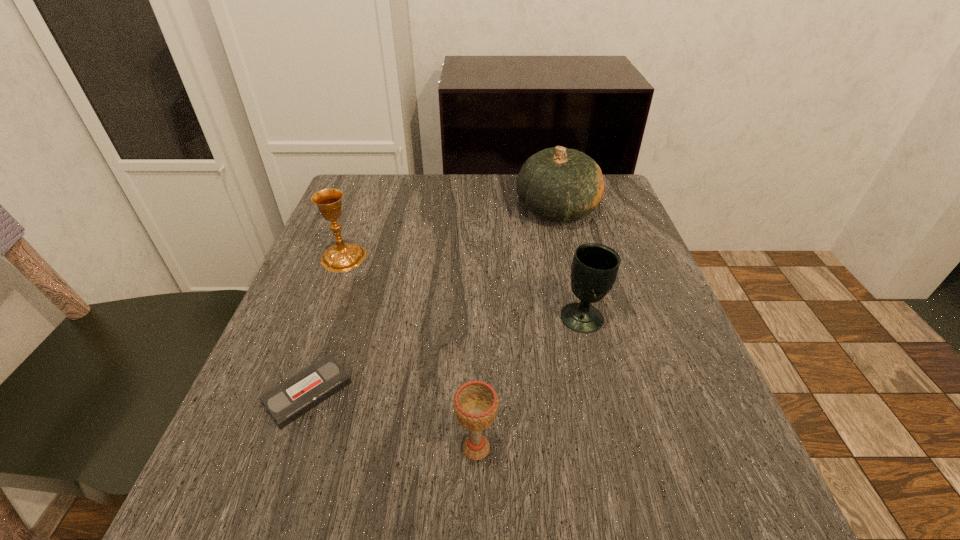
Locate an element on the screen. The width and height of the screenshot is (960, 540). gourd is located at coordinates (559, 184).

The height and width of the screenshot is (540, 960). Find the location of `the leftmost chalice`. the leftmost chalice is located at coordinates (342, 257).

Identify the location of the second farthest object. Image resolution: width=960 pixels, height=540 pixels. (342, 257).

In order to click on the rightmost chalice in this screenshot , I will do pyautogui.click(x=594, y=268).

Locate an element on the screen. The image size is (960, 540). the third farthest object is located at coordinates (594, 268).

Identify the location of the second shortest object. This screenshot has width=960, height=540. (475, 403).

You are a GUI agent. You are given a task and a screenshot of the screen. Output one action in this format:
    pyautogui.click(x=<x>, y=<y>)
    Task: Click on the second chalice from right to left
    The width and height of the screenshot is (960, 540).
    Given the screenshot: What is the action you would take?
    pyautogui.click(x=475, y=403)

You are a GUI agent. You are given a task and a screenshot of the screen. Output one action in this format:
    pyautogui.click(x=<x>, y=<y>)
    Task: Click on the shortest object
    This screenshot has height=540, width=960.
    Given the screenshot: What is the action you would take?
    pyautogui.click(x=286, y=402)

Find the location of a particular element. vacant space located 0.200m on the front of the farthest object is located at coordinates (577, 292).

Find the location of `free region located 0.090m on the back of the leftmost chalice`. free region located 0.090m on the back of the leftmost chalice is located at coordinates (357, 222).